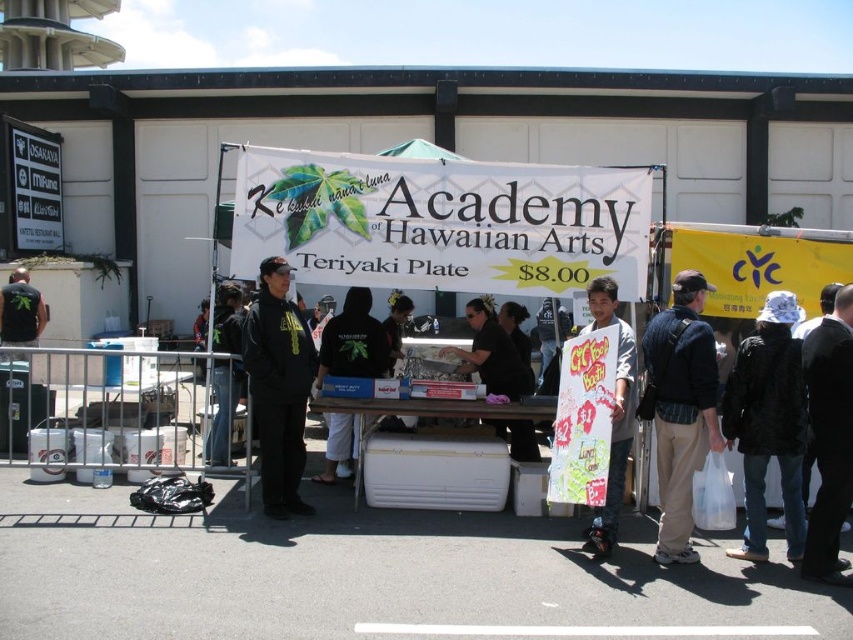
Question: Which point is farther from the camera taking this photo?

Choices:
 (A) (753, 508)
 (B) (370, 301)
 (C) (285, 288)

Answer: (B)

Question: Does white cotton hat at lower right have a lesser width compared to black matte hoodie at center?

Choices:
 (A) yes
 (B) no

Answer: (B)

Question: Observing the image, what is the correct spatial positioning of dark blue jacket at center in reference to white cotton hat at lower right?

Choices:
 (A) below
 (B) above

Answer: (B)

Question: Is dark blue jacket at center wider than black matte hoodie at center?

Choices:
 (A) no
 (B) yes

Answer: (A)

Question: Which point is closer to the camera?

Choices:
 (A) dark blue jacket at center
 (B) white cotton hat at lower right
 (C) black matte hoodie at center

Answer: (A)

Question: Considering the real-world distances, which object is closest to the black matte hoodie at center?

Choices:
 (A) white cotton hat at lower right
 (B) black hoodie at center

Answer: (B)